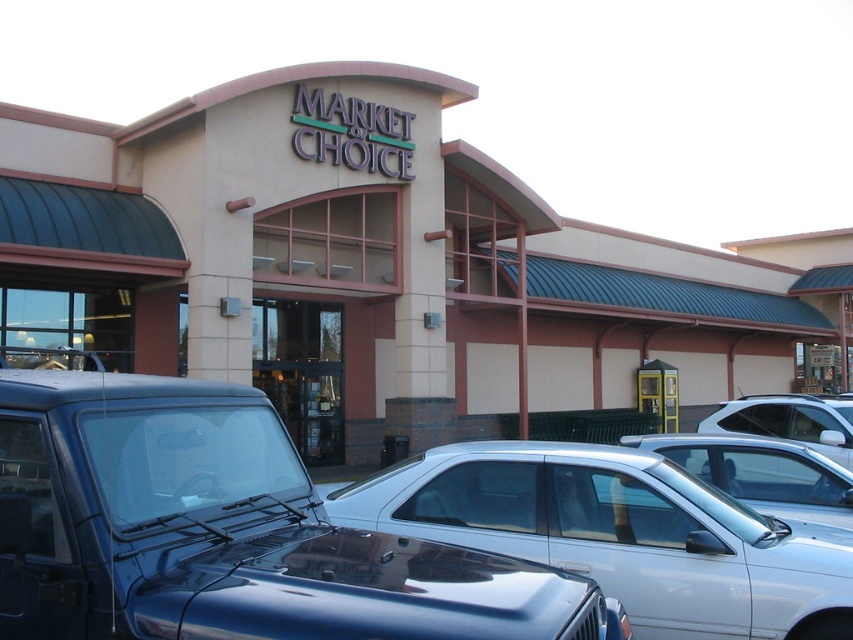
Is metallic silver sedan at center further to camera compared to white glossy sedan at center?

No, metallic silver sedan at center is in front of white glossy sedan at center.

Can you confirm if metallic silver sedan at center is positioned above white glossy sedan at center?

Yes.

Is point (827, 458) positioned before point (821, 413)?

Yes, it is.

Find the location of a particular element. metallic silver sedan at center is located at coordinates (761, 472).

Based on the photo, is beige/smooth building at center shorter than shiny blue suv at center?

No, beige/smooth building at center is not shorter than shiny blue suv at center.

Which is behind, point (386, 333) or point (86, 592)?

Positioned behind is point (386, 333).

What are the coordinates of `beige/smooth building at center` in the screenshot? It's located at (380, 268).

Who is shorter, silver metallic sedan at center or white glossy sedan at center?

Standing shorter between the two is silver metallic sedan at center.

Is silver metallic sedan at center shorter than white glossy sedan at center?

Yes.

Locate an element on the screen. Image resolution: width=853 pixels, height=640 pixels. silver metallic sedan at center is located at coordinates (621, 534).